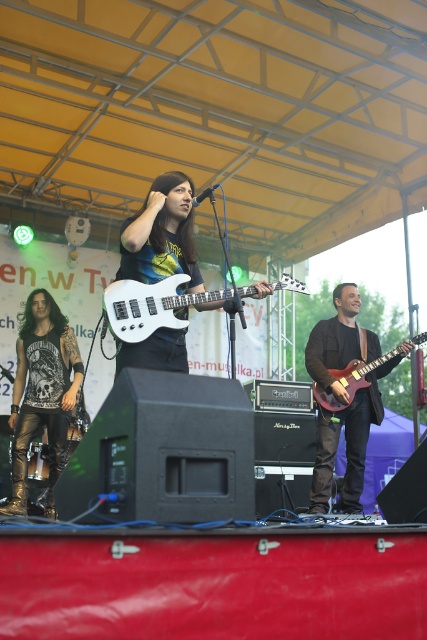
You are a stagehand setting up equipment for a concert. You need to place a tall amplifier that requires 1.2 meters of vertical space. Looking at the stage, which guitar between the matte black guitar at center and the white glossy electric guitar at center can be placed under the amplifier without blocking its height requirement?

The matte black guitar at center is much taller than the white glossy electric guitar at center. Since the amplifier needs 1.2 meters of vertical space, the white glossy electric guitar at center, being shorter, can be placed under the amplifier without blocking its height requirement.

You are a stagehand who needs to adjust the microphone stand between the matte black guitar at center and the white glossy electric guitar at center. Which guitar should you move forward to make space?

The matte black guitar at center is already in front of the white glossy electric guitar at center. To make space, you should move the white glossy electric guitar at center backward since it is behind the matte black one.

Based on the scene description, where exactly is the shiny gold pants at center located in the image?

The shiny gold pants at center is located at point coordinates of 0.616 on the x axis and 0.098 on the y axis.